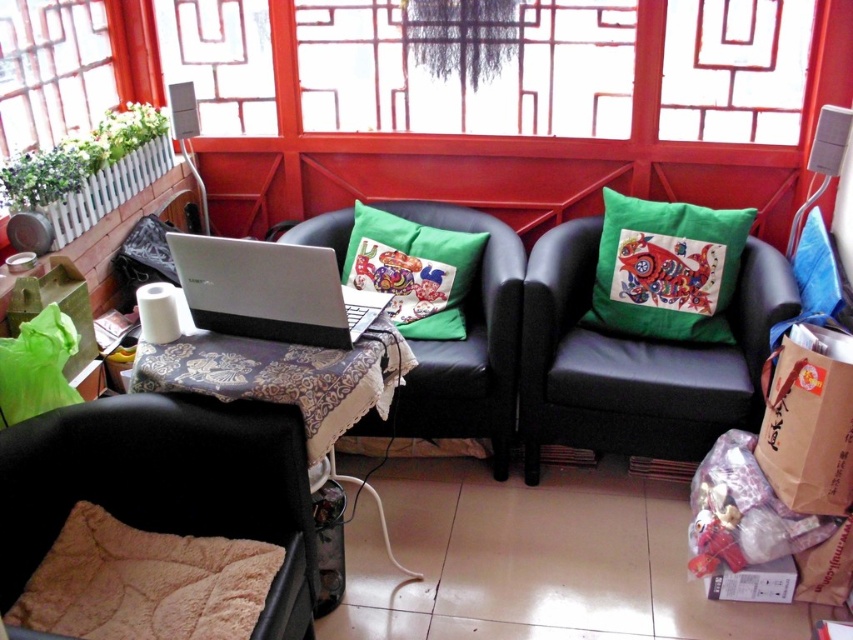
Find the location of a particular element. Image resolution: width=853 pixels, height=640 pixels. black leather couch at right is located at coordinates (636, 358).

Can you confirm if black leather couch at right is bigger than green fabric cushion at center?

Correct, black leather couch at right is larger in size than green fabric cushion at center.

Who is more forward, (590, 429) or (461, 273)?

Point (590, 429) is in front.

At what (x,y) coordinates should I click in order to perform the action: click on black leather couch at right. Please return your answer as a coordinate pair (x, y). Looking at the image, I should click on (636, 358).

Does black leather couch at center come behind green fabric cushion at center?

That is False.

Find the location of a particular element. The image size is (853, 640). black leather couch at center is located at coordinates (469, 342).

Who is more forward, [433,218] or [358,268]?

Positioned in front is point [358,268].

Locate an element on the screen. black leather couch at center is located at coordinates (469, 342).

Who is positioned more to the right, black soft armchair at lower left or black leather couch at center?

Positioned to the right is black leather couch at center.

Who is more distant from viewer, (270, 632) or (500, 221)?

The point (500, 221) is more distant.

Who is more distant from viewer, (166,467) or (440,348)?

Positioned behind is point (440,348).

Locate an element on the screen. black soft armchair at lower left is located at coordinates (165, 484).